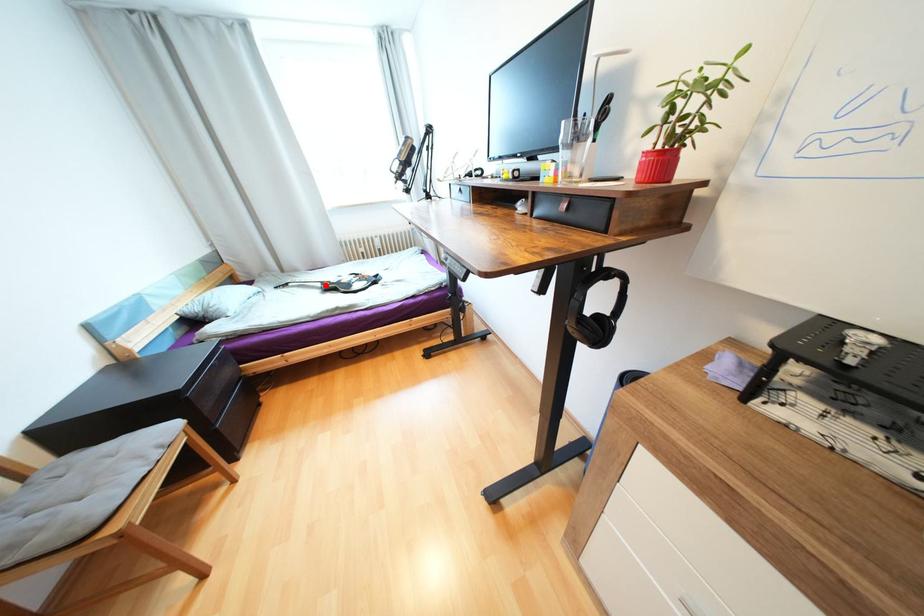
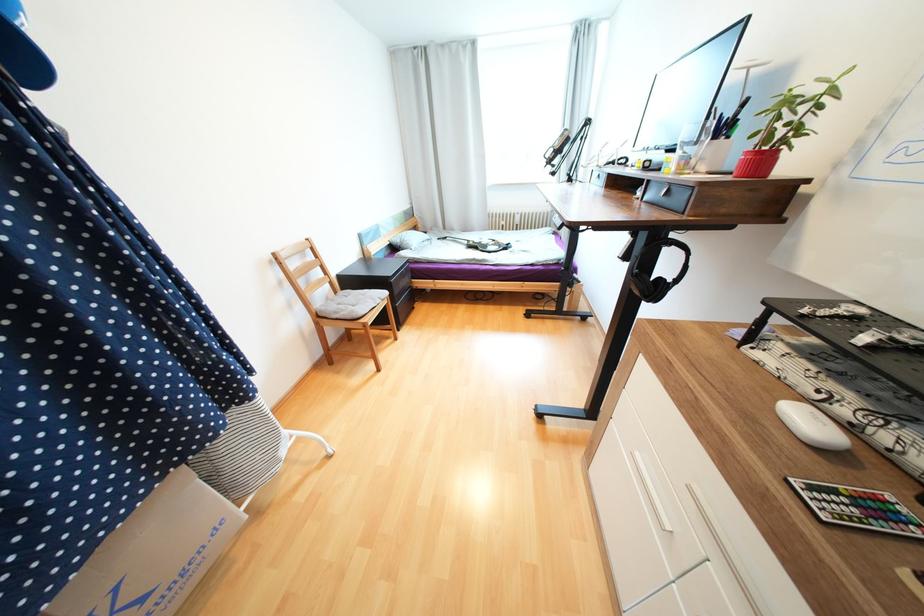
Question: I am providing you with two images of the same scene from different viewpoints. Given a red point in image1, look at the same physical point in image2. Is it:

Choices:
 (A) Closer to the viewpoint
 (B) Farther from the viewpoint

Answer: (B)